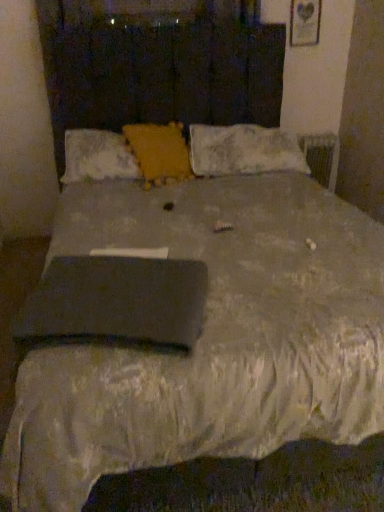
Measure the distance between point (152, 302) and camera.

Point (152, 302) and camera are 3.89 feet apart.

What do you see at coordinates (117, 302) in the screenshot? The image size is (384, 512). I see `black matte pad at center` at bounding box center [117, 302].

Image resolution: width=384 pixels, height=512 pixels. I want to click on white fluffy pillow at upper right, arranged as the third pillow when viewed from the left, so click(243, 150).

Would you consider white fluffy pillow at upper right, arranged as the third pillow when viewed from the left, to be distant from yellow textured pillow at center, which is the second pillow from left to right?

Actually, white fluffy pillow at upper right, arranged as the third pillow when viewed from the left, and yellow textured pillow at center, which is the second pillow from left to right, are a little close together.

From a real-world perspective, which is physically above, white fluffy pillow at upper right, acting as the 1th pillow starting from the right, or yellow textured pillow at center, which appears as the second pillow when viewed from the right?

In real-world perspective, yellow textured pillow at center, which appears as the second pillow when viewed from the right, is above.

Is white fluffy pillow at upper right, acting as the 1th pillow starting from the right, spatially inside yellow textured pillow at center, which appears as the second pillow when viewed from the right, or outside of it?

white fluffy pillow at upper right, acting as the 1th pillow starting from the right, is outside yellow textured pillow at center, which appears as the second pillow when viewed from the right.

Is velvet yellow pillow at center, which is the third pillow in right-to-left order, not close to yellow textured pillow at center, which is the second pillow from left to right?

No.

Is velvet yellow pillow at center, which is the third pillow in right-to-left order, to the left or to the right of yellow textured pillow at center, which is the second pillow from left to right, in the image?

In the image, velvet yellow pillow at center, which is the third pillow in right-to-left order, appears on the left side of yellow textured pillow at center, which is the second pillow from left to right.

Could yellow textured pillow at center, which appears as the second pillow when viewed from the right, be considered to be inside velvet yellow pillow at center, which is the third pillow in right-to-left order?

Yes, yellow textured pillow at center, which appears as the second pillow when viewed from the right, is surrounded by velvet yellow pillow at center, which is the third pillow in right-to-left order.

What's the angular difference between yellow textured pillow at center, which appears as the second pillow when viewed from the right, and white fluffy pillow at upper right, acting as the 1th pillow starting from the right,'s facing directions?

18.1 degrees separate the facing orientations of yellow textured pillow at center, which appears as the second pillow when viewed from the right, and white fluffy pillow at upper right, acting as the 1th pillow starting from the right.

Which of these two, yellow textured pillow at center, which is the second pillow from left to right, or white fluffy pillow at upper right, arranged as the third pillow when viewed from the left, is smaller?

With smaller size is yellow textured pillow at center, which is the second pillow from left to right.

From the image's perspective, between yellow textured pillow at center, which is the second pillow from left to right, and white fluffy pillow at upper right, arranged as the third pillow when viewed from the left, who is located below?

yellow textured pillow at center, which is the second pillow from left to right, is shown below in the image.

Based on their positions, is yellow textured pillow at center, which is the second pillow from left to right, located to the left or right of white fluffy pillow at upper right, acting as the 1th pillow starting from the right?

yellow textured pillow at center, which is the second pillow from left to right, is positioned on white fluffy pillow at upper right, acting as the 1th pillow starting from the right,'s left side.

Which of these two, black matte pad at center or yellow textured pillow at center, which appears as the second pillow when viewed from the right, is thinner?

yellow textured pillow at center, which appears as the second pillow when viewed from the right.

Measure the distance between black matte pad at center and yellow textured pillow at center, which is the second pillow from left to right.

black matte pad at center is 1.19 meters from yellow textured pillow at center, which is the second pillow from left to right.

Considering the sizes of objects black matte pad at center and yellow textured pillow at center, which appears as the second pillow when viewed from the right, in the image provided, who is shorter, black matte pad at center or yellow textured pillow at center, which appears as the second pillow when viewed from the right,?

black matte pad at center.

Could you tell me if black matte pad at center is facing yellow textured pillow at center, which is the second pillow from left to right?

No, black matte pad at center does not turn towards yellow textured pillow at center, which is the second pillow from left to right.

Which of these two, black matte pad at center or velvet yellow pillow at center, which ranks as the 1th pillow in left-to-right order, is wider?

Wider between the two is black matte pad at center.

Between point (166, 280) and point (90, 159), which one is positioned behind?

The point (90, 159) is farther from the camera.

From the image's perspective, does black matte pad at center appear higher than velvet yellow pillow at center, which is the third pillow in right-to-left order?

No, from the image's perspective, black matte pad at center is not above velvet yellow pillow at center, which is the third pillow in right-to-left order.

Which of these two, black matte pad at center or velvet yellow pillow at center, which ranks as the 1th pillow in left-to-right order, stands taller?

Standing taller between the two is velvet yellow pillow at center, which ranks as the 1th pillow in left-to-right order.

Consider the image. Is yellow textured pillow at center, which appears as the second pillow when viewed from the right, inside the boundaries of velvet yellow pillow at center, which ranks as the 1th pillow in left-to-right order, or outside?

yellow textured pillow at center, which appears as the second pillow when viewed from the right, fits inside velvet yellow pillow at center, which ranks as the 1th pillow in left-to-right order.

Considering their positions, is yellow textured pillow at center, which is the second pillow from left to right, located in front of or behind velvet yellow pillow at center, which ranks as the 1th pillow in left-to-right order?

yellow textured pillow at center, which is the second pillow from left to right, is in front of velvet yellow pillow at center, which ranks as the 1th pillow in left-to-right order.

Does point (219, 174) come behind point (93, 273)?

That is True.

In the image, is white fluffy pillow at upper right, arranged as the third pillow when viewed from the left, on the left side or the right side of black matte pad at center?

white fluffy pillow at upper right, arranged as the third pillow when viewed from the left, is positioned on black matte pad at center's right side.

Looking at the image, does white fluffy pillow at upper right, acting as the 1th pillow starting from the right, seem bigger or smaller compared to black matte pad at center?

Clearly, white fluffy pillow at upper right, acting as the 1th pillow starting from the right, is larger in size than black matte pad at center.

I want to click on pillow on the right of the yellow textured pillow at center, which appears as the second pillow when viewed from the right, so click(x=243, y=150).

Where is `pillow lying below the yellow textured pillow at center, which appears as the second pillow when viewed from the right (from the image's perspective)`? The image size is (384, 512). pillow lying below the yellow textured pillow at center, which appears as the second pillow when viewed from the right (from the image's perspective) is located at coordinates (97, 157).

Which object lies further to the anchor point white fluffy pillow at upper right, arranged as the third pillow when viewed from the left, yellow textured pillow at center, which is the second pillow from left to right, or velvet yellow pillow at center, which ranks as the 1th pillow in left-to-right order?

velvet yellow pillow at center, which ranks as the 1th pillow in left-to-right order, is positioned further to the anchor white fluffy pillow at upper right, arranged as the third pillow when viewed from the left.

Based on their spatial positions, is white fluffy pillow at upper right, acting as the 1th pillow starting from the right, or yellow textured pillow at center, which appears as the second pillow when viewed from the right, further from black matte pad at center?

white fluffy pillow at upper right, acting as the 1th pillow starting from the right, lies further to black matte pad at center than the other object.

From the image, which object appears to be nearer to yellow textured pillow at center, which is the second pillow from left to right, black matte pad at center or velvet yellow pillow at center, which ranks as the 1th pillow in left-to-right order?

The object closer to yellow textured pillow at center, which is the second pillow from left to right, is velvet yellow pillow at center, which ranks as the 1th pillow in left-to-right order.

Which object lies further to the anchor point white fluffy pillow at upper right, acting as the 1th pillow starting from the right, velvet yellow pillow at center, which is the third pillow in right-to-left order, or black matte pad at center?

black matte pad at center is positioned further to the anchor white fluffy pillow at upper right, acting as the 1th pillow starting from the right.

Estimate the real-world distances between objects in this image. Which object is closer to yellow textured pillow at center, which appears as the second pillow when viewed from the right, white fluffy pillow at upper right, acting as the 1th pillow starting from the right, or black matte pad at center?

Among the two, white fluffy pillow at upper right, acting as the 1th pillow starting from the right, is located nearer to yellow textured pillow at center, which appears as the second pillow when viewed from the right.

Which object lies further to the anchor point black matte pad at center, velvet yellow pillow at center, which is the third pillow in right-to-left order, or white fluffy pillow at upper right, arranged as the third pillow when viewed from the left?

white fluffy pillow at upper right, arranged as the third pillow when viewed from the left.

Based on their spatial positions, is black matte pad at center or white fluffy pillow at upper right, arranged as the third pillow when viewed from the left, further from yellow textured pillow at center, which appears as the second pillow when viewed from the right?

Among the two, black matte pad at center is located further to yellow textured pillow at center, which appears as the second pillow when viewed from the right.

Based on their spatial positions, is black matte pad at center or yellow textured pillow at center, which is the second pillow from left to right, further from white fluffy pillow at upper right, arranged as the third pillow when viewed from the left?

Based on the image, black matte pad at center appears to be further to white fluffy pillow at upper right, arranged as the third pillow when viewed from the left.

Identify the location of pillow between velvet yellow pillow at center, which ranks as the 1th pillow in left-to-right order, and white fluffy pillow at upper right, acting as the 1th pillow starting from the right, from left to right. (159, 152).

This screenshot has height=512, width=384. In order to click on pillow between black matte pad at center and velvet yellow pillow at center, which ranks as the 1th pillow in left-to-right order, in the front-back direction in this screenshot , I will do `click(159, 152)`.